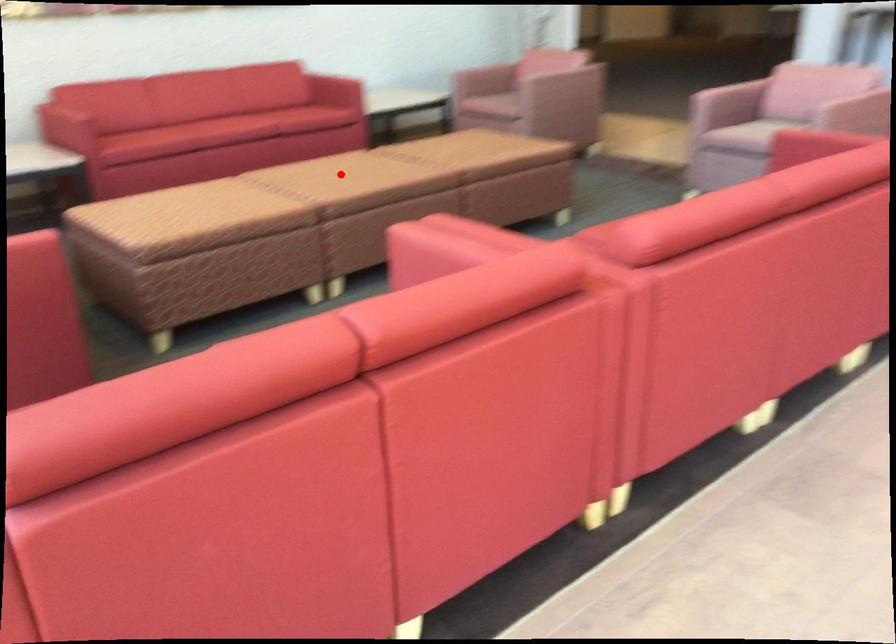
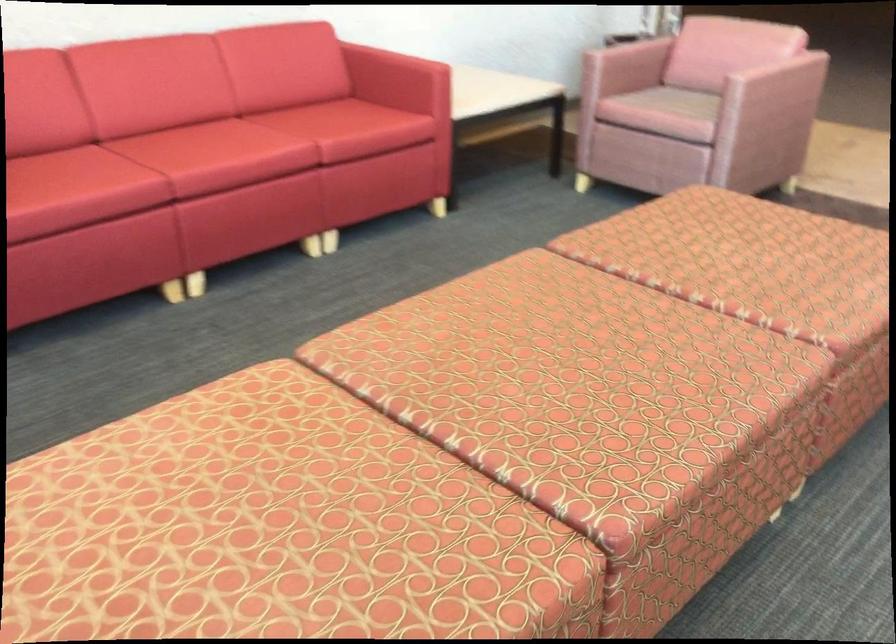
Question: I am providing you with two images of the same scene from different viewpoints. Image1 has a red point marked. In image2, the corresponding 3D location appears at what relative position? Reply with the corresponding letter.

Choices:
 (A) Closer
 (B) Farther

Answer: (A)